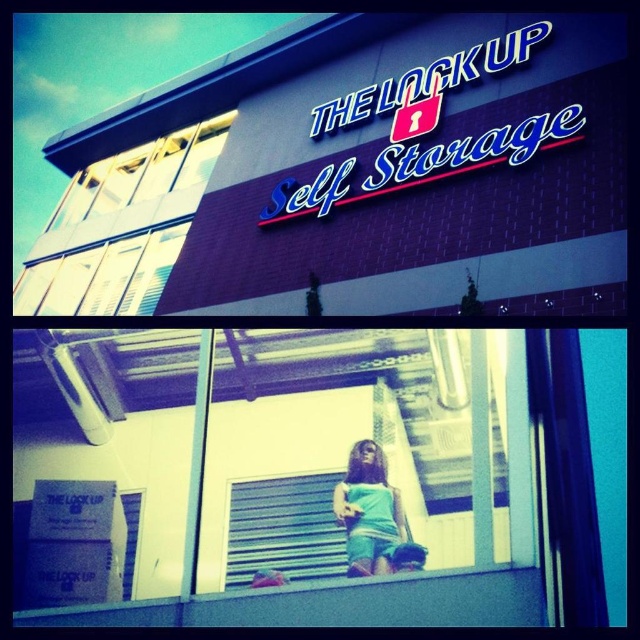
You are standing outside the storage facility looking at the window. Can you see the teal fabric dress at center through the transparent glass window at upper left?

Yes, because the transparent glass window at upper left is positioned over the teal fabric dress at center, allowing visibility through it.

In the scene shown: You are standing outside the storage facility and want to check if the teal fabric dress at center is visible through the transparent glass window at upper left. Given that the window is 1 meter in height and the dress is 1.5 meters tall, can you see the dress through the window?

The transparent glass window at upper left and teal fabric dress at center are 57.83 meters apart. Since the distance between them is over 50 meters, the dress would likely be too far away to see clearly through the window. The window is only 1 meter tall, which might not provide enough viewing area to discern details of the 1.5 meter tall dress from that distance.